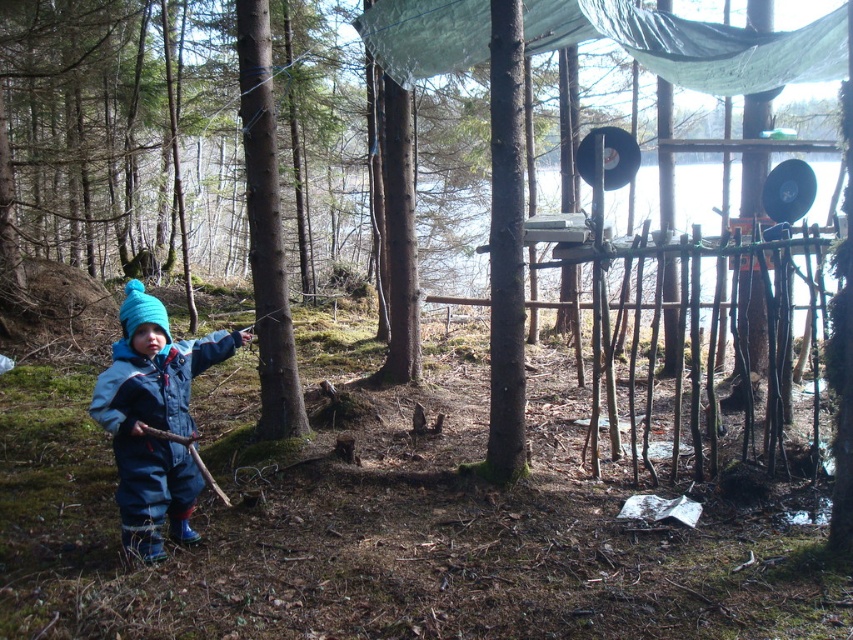
You are a GUI agent. You are given a task and a screenshot of the screen. Output one action in this format:
    pyautogui.click(x=<x>, y=<y>)
    Task: Click on the transparent tarpaulin at upper center
    
    Given the screenshot: What is the action you would take?
    pyautogui.click(x=694, y=44)

Between point (677, 81) and point (177, 401), which one is positioned in front?

Point (177, 401) is more forward.

You are a GUI agent. You are given a task and a screenshot of the screen. Output one action in this format:
    pyautogui.click(x=<x>, y=<y>)
    Task: Click on the transparent tarpaulin at upper center
    The height and width of the screenshot is (640, 853).
    Given the screenshot: What is the action you would take?
    pyautogui.click(x=694, y=44)

Is point (554, 48) more distant than point (283, 362)?

Yes, point (554, 48) is farther from viewer.

Does point (479, 28) lie in front of point (254, 161)?

No, it is not.

Locate an element on the screen. transparent tarpaulin at upper center is located at coordinates (694, 44).

Which of these two, blue fleece jumpsuit at lower left or brown rough bark tree at center, stands shorter?

With less height is blue fleece jumpsuit at lower left.

Which is in front, point (187, 372) or point (288, 349)?

Point (187, 372)

Does point (134, 362) come in front of point (287, 305)?

That is True.

At what (x,y) coordinates should I click in order to perform the action: click on blue fleece jumpsuit at lower left. Please return your answer as a coordinate pair (x, y). Looking at the image, I should click on (154, 419).